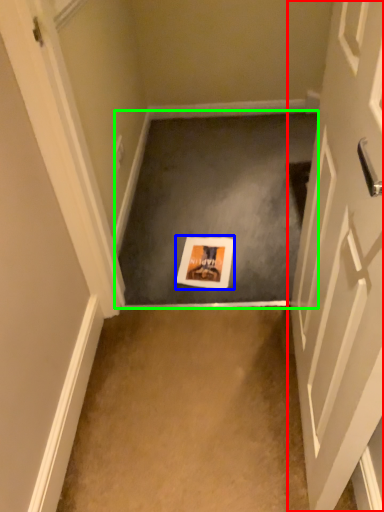
Question: Estimate the real-world distances between objects in this image. Which object is farther from door (highlighted by a red box), postcard (highlighted by a blue box) or concrete (highlighted by a green box)?

Choices:
 (A) postcard
 (B) concrete

Answer: (B)